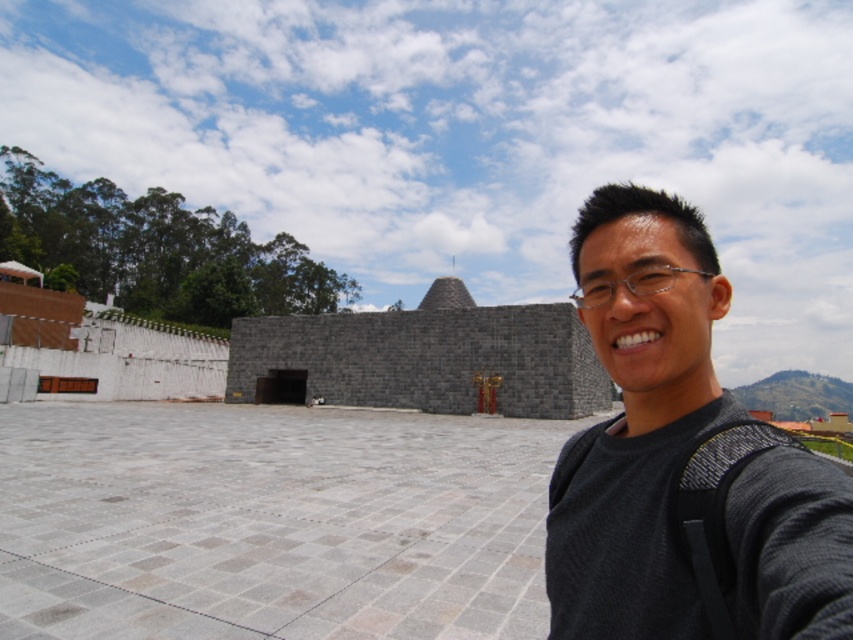
Between point (679, 449) and point (549, 305), which one is positioned behind?

The point (549, 305) is more distant.

Who is positioned more to the right, black fabric at right or gray stone pyramid at center?

From the viewer's perspective, black fabric at right appears more on the right side.

At what (x,y) coordinates should I click in order to perform the action: click on black fabric at right. Please return your answer as a coordinate pair (x, y). This screenshot has height=640, width=853. Looking at the image, I should click on (682, 460).